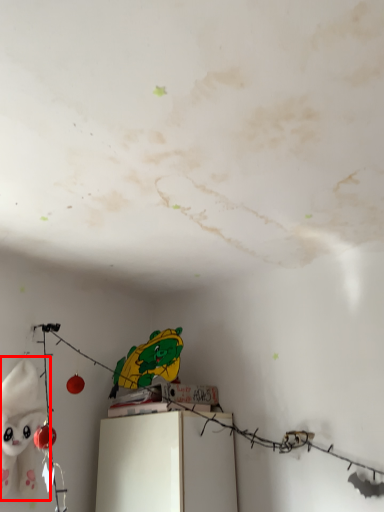
Question: From the image's perspective, where is toy (annotated by the red box) located in relation to furniture in the image?

Choices:
 (A) below
 (B) above

Answer: (B)